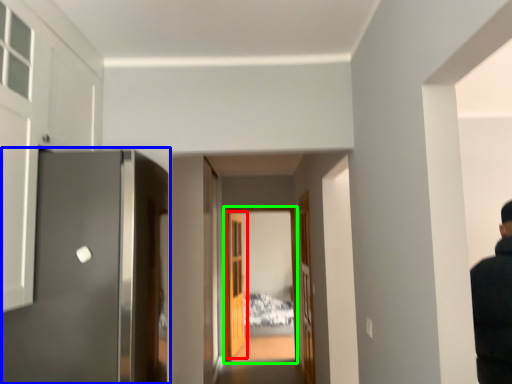
Question: Based on their relative distances, which object is nearer to door (highlighted by a red box)? Choose from door (highlighted by a blue box) and glass door (highlighted by a green box).

Choices:
 (A) door
 (B) glass door

Answer: (B)